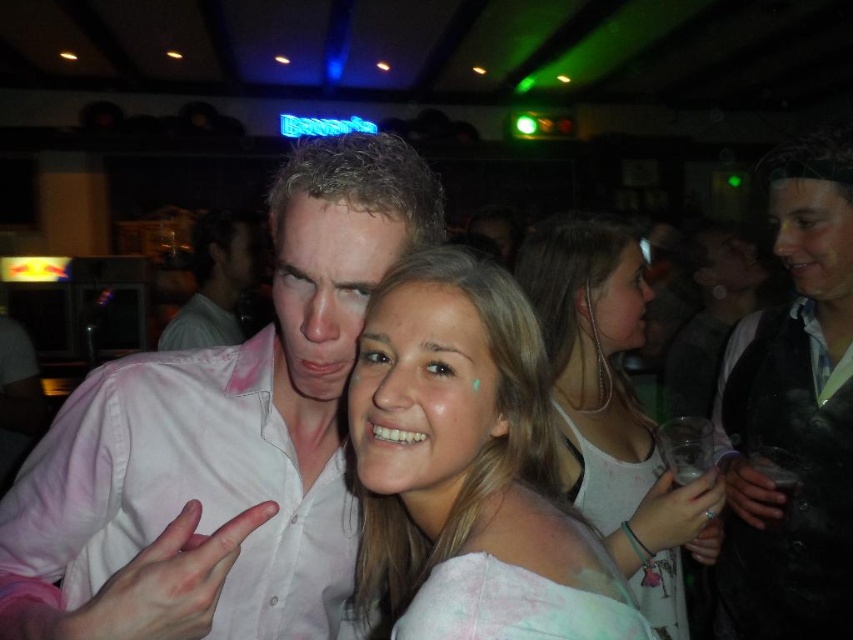
You are trying to determine which object in the scene is bigger between the pink cotton shirt at center and the light brown hair at center. Based on the scene description, which one is larger?

The pink cotton shirt at center has a larger size compared to light brown hair at center, so the pink cotton shirt at center is bigger.

You are taking a photo of two points in the image. The first point is at coordinates point (201, 465) and the second is at point (229, 333). Which point will appear larger in your photo?

Point (201, 465) is closer to the camera than point (229, 333), so it will appear larger in the photo.

You are at the entrance of the venue and want to find the person wearing the pink cotton shirt at center. According to the spatial coordinates provided, in which direction should you move from your current position to locate them?

The pink cotton shirt at center is located at point coordinates, so you should move towards the center area of the venue to find them.